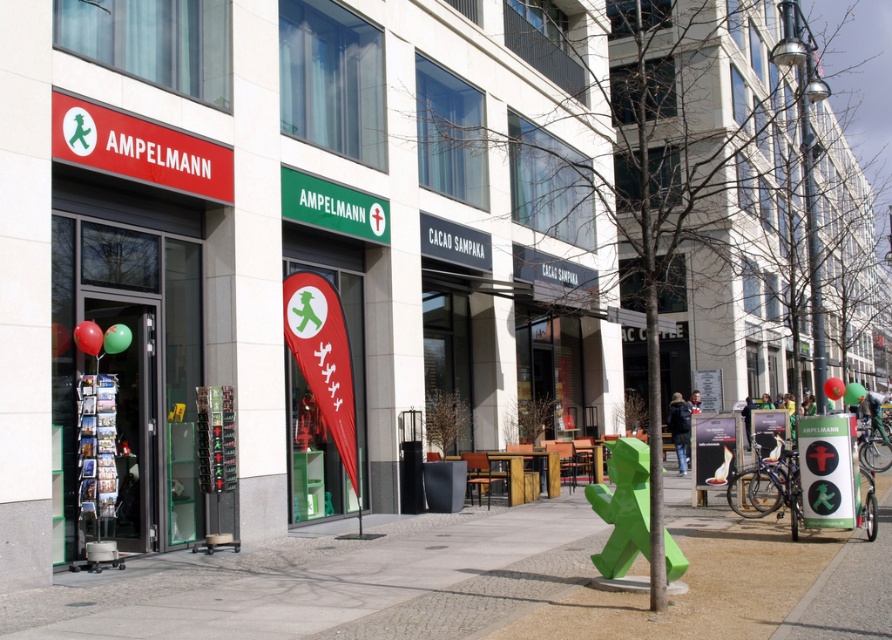
You are a city planner evaluating the street layout. The two signs, green plastic pedestrian sign at center and green matte sign at center, are both important for pedestrian safety. Which one is taller?

The green plastic pedestrian sign at center is taller than the green matte sign at center.

You are a delivery person trying to park your bike. The bike requires 2 meters of space to fit. You see the green concrete pavement at center and the green matte sign at center. Which area can accommodate your bike?

The green concrete pavement at center has a larger width than the green matte sign at center, so it can accommodate the bike that needs 2 meters of space.